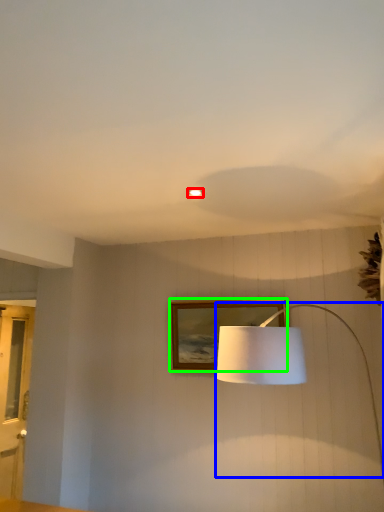
Question: Which object is positioned farthest from lighting (highlighted by a red box)? Select from lamp (highlighted by a blue box) and picture frame (highlighted by a green box).

Choices:
 (A) lamp
 (B) picture frame

Answer: (B)